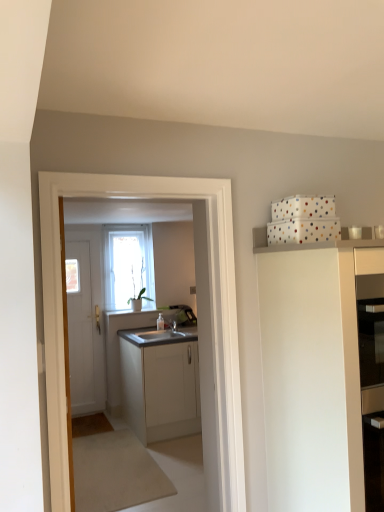
Where is `white matte cabinet at upper right, the 2th cabinetry when ordered from back to front`? Image resolution: width=384 pixels, height=512 pixels. white matte cabinet at upper right, the 2th cabinetry when ordered from back to front is located at coordinates (312, 371).

This screenshot has width=384, height=512. Find the location of `white matte cabinet at upper right, which is the first cabinetry in right-to-left order`. white matte cabinet at upper right, which is the first cabinetry in right-to-left order is located at coordinates (312, 371).

Based on the photo, which object is thinner, white matte cabinet at upper right, acting as the 2th cabinetry starting from the left, or transparent glass window at center?

transparent glass window at center.

Would you consider white matte cabinet at upper right, acting as the 2th cabinetry starting from the left, to be distant from transparent glass window at center?

Yes, white matte cabinet at upper right, acting as the 2th cabinetry starting from the left, and transparent glass window at center are quite far apart.

From the image's perspective, which one is positioned lower, white matte cabinet at upper right, the 1th cabinetry in the front-to-back sequence, or transparent glass window at center?

white matte cabinet at upper right, the 1th cabinetry in the front-to-back sequence, appears lower in the image.

Is white matte cabinet at upper right, the 1th cabinetry in the front-to-back sequence, smaller than transparent glass window at center?

Actually, white matte cabinet at upper right, the 1th cabinetry in the front-to-back sequence, might be larger than transparent glass window at center.

From the image's perspective, is transparent glass window at center below white matte cabinet at center, the second cabinetry from the front?

No, from the image's perspective, transparent glass window at center is not beneath white matte cabinet at center, the second cabinetry from the front.

Would you say white matte cabinet at center, the second cabinetry from the front, is part of transparent glass window at center's contents?

Actually, white matte cabinet at center, the second cabinetry from the front, is outside transparent glass window at center.

Between transparent glass window at center and white matte cabinet at center, the second cabinetry from the front, which one has smaller size?

transparent glass window at center is smaller.

From a real-world perspective, is transparent glass window at center below white matte cabinet at center, which ranks as the first cabinetry in back-to-front order?

No, from a real-world perspective, transparent glass window at center is not below white matte cabinet at center, which ranks as the first cabinetry in back-to-front order.

Between white matte cabinet at center, which ranks as the first cabinetry in back-to-front order, and transparent glass window at center, which one has larger width?

white matte cabinet at center, which ranks as the first cabinetry in back-to-front order, is wider.

Which is behind, white matte cabinet at center, which ranks as the first cabinetry in back-to-front order, or transparent glass window at center?

Positioned behind is transparent glass window at center.

Is white matte cabinet at center, the second cabinetry from the front, oriented towards transparent glass window at center?

No, white matte cabinet at center, the second cabinetry from the front, is not facing towards transparent glass window at center.

From the image's perspective, which one is positioned lower, white matte cabinet at center, which ranks as the first cabinetry in back-to-front order, or transparent glass window at center?

white matte cabinet at center, which ranks as the first cabinetry in back-to-front order, is shown below in the image.

Is white matte cabinet at upper right, acting as the 2th cabinetry starting from the left, at the back of white matte cabinet at center, which ranks as the first cabinetry in back-to-front order?

No, white matte cabinet at center, which ranks as the first cabinetry in back-to-front order, is not facing the opposite direction of white matte cabinet at upper right, acting as the 2th cabinetry starting from the left.

Considering the sizes of objects white matte cabinet at center, which ranks as the first cabinetry in back-to-front order, and white matte cabinet at upper right, the 1th cabinetry in the front-to-back sequence, in the image provided, who is smaller, white matte cabinet at center, which ranks as the first cabinetry in back-to-front order, or white matte cabinet at upper right, the 1th cabinetry in the front-to-back sequence,?

With smaller size is white matte cabinet at upper right, the 1th cabinetry in the front-to-back sequence.

Is white matte cabinet at upper right, which is the first cabinetry in right-to-left order, completely or partially inside white matte cabinet at center, which is the 1th cabinetry in left-to-right order?

No, white matte cabinet at upper right, which is the first cabinetry in right-to-left order, is not surrounded by white matte cabinet at center, which is the 1th cabinetry in left-to-right order.

Considering the relative positions of white matte cabinet at upper right, the 1th cabinetry in the front-to-back sequence, and white matte door at left in the image provided, is white matte cabinet at upper right, the 1th cabinetry in the front-to-back sequence, to the left or to the right of white matte door at left?

Clearly, white matte cabinet at upper right, the 1th cabinetry in the front-to-back sequence, is on the right of white matte door at left in the image.

Where is `door that appears on the left of white matte cabinet at upper right, which is the first cabinetry in right-to-left order`? The width and height of the screenshot is (384, 512). door that appears on the left of white matte cabinet at upper right, which is the first cabinetry in right-to-left order is located at coordinates (86, 330).

Considering the positions of point (274, 464) and point (81, 297), is point (274, 464) closer or farther from the camera than point (81, 297)?

Point (274, 464) is positioned closer to the camera compared to point (81, 297).

Can white matte cabinet at center, the second cabinetry in the right-to-left sequence, be found inside white matte cabinet at upper right, the 1th cabinetry in the front-to-back sequence?

No, white matte cabinet at center, the second cabinetry in the right-to-left sequence, is not surrounded by white matte cabinet at upper right, the 1th cabinetry in the front-to-back sequence.

How different are the orientations of white matte cabinet at upper right, acting as the 2th cabinetry starting from the left, and white matte cabinet at center, which is the 1th cabinetry in left-to-right order, in degrees?

white matte cabinet at upper right, acting as the 2th cabinetry starting from the left, and white matte cabinet at center, which is the 1th cabinetry in left-to-right order, are facing 1.91 degrees away from each other.

Considering the points (294, 457) and (192, 378), which point is in front, point (294, 457) or point (192, 378)?

Positioned in front is point (294, 457).

In the scene shown: Is white matte cabinet at upper right, which is the first cabinetry in right-to-left order, looking in the opposite direction of white matte cabinet at center, which ranks as the first cabinetry in back-to-front order?

Yes, white matte cabinet at upper right, which is the first cabinetry in right-to-left order, is positioned with its back facing white matte cabinet at center, which ranks as the first cabinetry in back-to-front order.

Which of these two, transparent glass window at center or white matte door at left, stands shorter?

transparent glass window at center.

Can you confirm if transparent glass window at center is thinner than white matte door at left?

In fact, transparent glass window at center might be wider than white matte door at left.

In the scene shown: In the image, is transparent glass window at center positioned in front of or behind white matte door at left?

transparent glass window at center is behind white matte door at left.

Are transparent glass window at center and white matte door at left beside each other?

No, transparent glass window at center is not with white matte door at left.

The width and height of the screenshot is (384, 512). Find the location of `window lying behind the white matte cabinet at upper right, which is the first cabinetry in right-to-left order`. window lying behind the white matte cabinet at upper right, which is the first cabinetry in right-to-left order is located at coordinates (128, 266).

Identify the location of window located above the white matte cabinet at center, the second cabinetry in the right-to-left sequence (from a real-world perspective). Image resolution: width=384 pixels, height=512 pixels. (128, 266).

In the scene shown: Which object lies further to the anchor point white matte cabinet at center, which is the 1th cabinetry in left-to-right order, white matte door at left or white matte cabinet at upper right, the 1th cabinetry in the front-to-back sequence?

white matte cabinet at upper right, the 1th cabinetry in the front-to-back sequence.

Based on their spatial positions, is transparent glass window at center or white matte cabinet at upper right, which is the first cabinetry in right-to-left order, closer to white matte door at left?

The object closer to white matte door at left is transparent glass window at center.

Estimate the real-world distances between objects in this image. Which object is closer to white matte cabinet at upper right, acting as the 2th cabinetry starting from the left, white matte door at left or white matte cabinet at center, the second cabinetry in the right-to-left sequence?

white matte cabinet at center, the second cabinetry in the right-to-left sequence, is closer to white matte cabinet at upper right, acting as the 2th cabinetry starting from the left.

Considering their positions, is white matte door at left positioned closer to white matte cabinet at upper right, which is the first cabinetry in right-to-left order, than transparent glass window at center?

Among the two, transparent glass window at center is located nearer to white matte cabinet at upper right, which is the first cabinetry in right-to-left order.

Estimate the real-world distances between objects in this image. Which object is further from white matte door at left, white matte cabinet at center, the second cabinetry from the front, or white matte cabinet at upper right, acting as the 2th cabinetry starting from the left?

white matte cabinet at upper right, acting as the 2th cabinetry starting from the left, lies further to white matte door at left than the other object.

Which object lies further to the anchor point white matte cabinet at center, which is the 1th cabinetry in left-to-right order, white matte door at left or transparent glass window at center?

The object further to white matte cabinet at center, which is the 1th cabinetry in left-to-right order, is transparent glass window at center.

Based on their spatial positions, is white matte cabinet at center, the second cabinetry from the front, or white matte door at left further from transparent glass window at center?

white matte cabinet at center, the second cabinetry from the front, is further to transparent glass window at center.

Which object lies nearer to the anchor point transparent glass window at center, white matte door at left or white matte cabinet at upper right, which is the first cabinetry in right-to-left order?

white matte door at left lies closer to transparent glass window at center than the other object.

Find the location of a particular element. cabinetry located between white matte cabinet at upper right, acting as the 2th cabinetry starting from the left, and white matte door at left in the depth direction is located at coordinates (160, 382).

Find the location of a particular element. Image resolution: width=384 pixels, height=512 pixels. door located between white matte cabinet at upper right, acting as the 2th cabinetry starting from the left, and transparent glass window at center in the depth direction is located at coordinates (86, 330).

Find the location of `cabinetry between white matte cabinet at upper right, acting as the 2th cabinetry starting from the left, and transparent glass window at center in the front-back direction`. cabinetry between white matte cabinet at upper right, acting as the 2th cabinetry starting from the left, and transparent glass window at center in the front-back direction is located at coordinates (160, 382).

You are a GUI agent. You are given a task and a screenshot of the screen. Output one action in this format:
    pyautogui.click(x=<x>, y=<y>)
    Task: Click on the door between transparent glass window at center and white matte cabinet at center, the second cabinetry in the right-to-left sequence, in the vertical direction
    
    Given the screenshot: What is the action you would take?
    pyautogui.click(x=86, y=330)